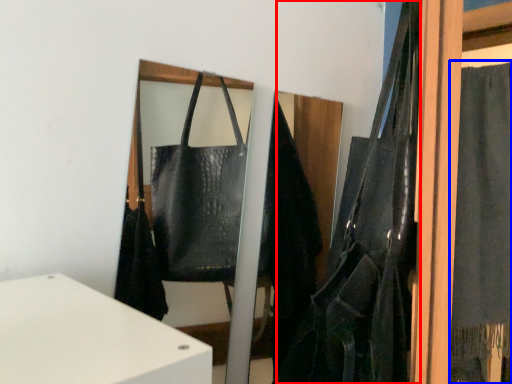
Question: Which object appears closest to the camera in this image, shoulder bag (highlighted by a red box) or curtain (highlighted by a blue box)?

Choices:
 (A) shoulder bag
 (B) curtain

Answer: (A)